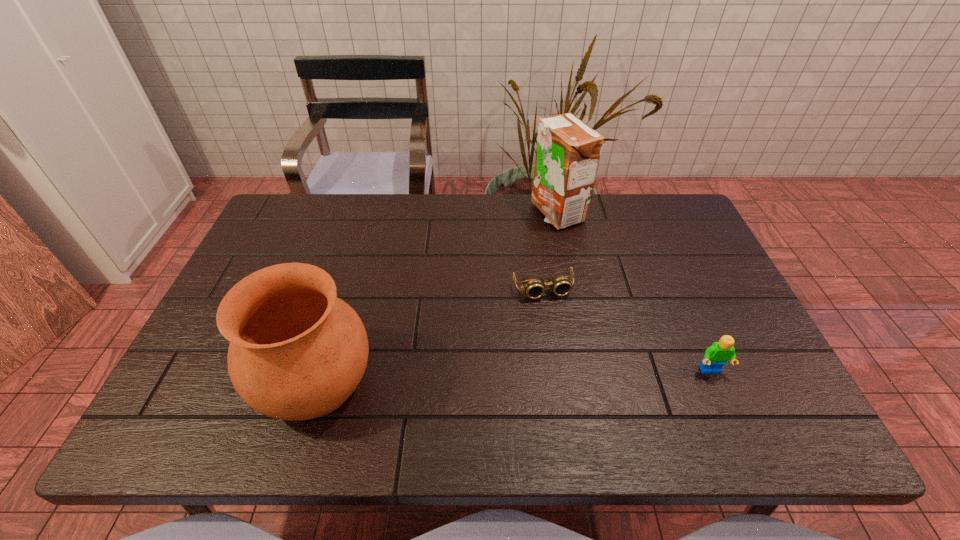
Where is `pottery`? pottery is located at coordinates (297, 352).

Where is `Lego`? The width and height of the screenshot is (960, 540). Lego is located at coordinates (717, 355).

At what (x,y) coordinates should I click in order to perform the action: click on the second shortest object. Please return your answer as a coordinate pair (x, y). This screenshot has height=540, width=960. Looking at the image, I should click on (717, 355).

This screenshot has height=540, width=960. Find the location of `the farthest object`. the farthest object is located at coordinates (568, 151).

The height and width of the screenshot is (540, 960). Identify the location of goggles. (533, 284).

You are a GUI agent. You are given a task and a screenshot of the screen. Output one action in this format:
    pyautogui.click(x=<x>, y=<y>)
    Task: Click on the shortest object
    Image resolution: width=960 pixels, height=540 pixels.
    Given the screenshot: What is the action you would take?
    pyautogui.click(x=533, y=284)

At what (x,y) coordinates should I click in order to perform the action: click on free location located on the right of the pottery. Please return your answer as a coordinate pair (x, y). This screenshot has height=540, width=960. Looking at the image, I should click on (519, 382).

This screenshot has height=540, width=960. I want to click on vacant space located 0.060m on the straw side of the carton, so click(543, 242).

I want to click on free space located 0.130m on the straw side of the carton, so click(x=536, y=257).

You are a GUI agent. You are given a task and a screenshot of the screen. Output one action in this format:
    pyautogui.click(x=<x>, y=<y>)
    Task: Click on the vacant space positioned 0.400m on the straw side of the carton
    
    Given the screenshot: What is the action you would take?
    [500, 324]